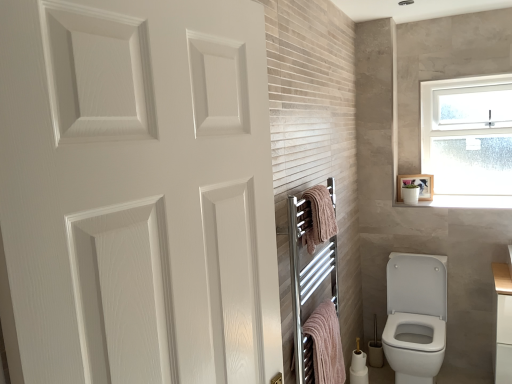
At what (x,y) coordinates should I click in order to perform the action: click on white glossy toilet paper at lower right, the 1th toilet paper from the top. Please return your answer as a coordinate pair (x, y). The height and width of the screenshot is (384, 512). Looking at the image, I should click on (358, 361).

This screenshot has height=384, width=512. What do you see at coordinates (416, 186) in the screenshot? I see `white glossy medicine cabinet at upper right` at bounding box center [416, 186].

Measure the distance between pink fabric towel at center, acting as the second bath towel starting from the bottom, and camera.

pink fabric towel at center, acting as the second bath towel starting from the bottom, and camera are 1.79 meters apart from each other.

What is the approximate width of pink fabric towel at center, acting as the second bath towel starting from the bottom?

It is 4.83 inches.

The width and height of the screenshot is (512, 384). What do you see at coordinates (463, 201) in the screenshot? I see `white ceramic window sill at upper right` at bounding box center [463, 201].

Where is `white glossy toilet paper at lower right, placed as the second toilet paper when sorted from top to bottom`? white glossy toilet paper at lower right, placed as the second toilet paper when sorted from top to bottom is located at coordinates (358, 366).

From a real-world perspective, is pink fabric towel at center-right, arranged as the 2th bath towel when viewed from the top, under white glossy medicine cabinet at upper right?

Yes, from a real-world perspective, pink fabric towel at center-right, arranged as the 2th bath towel when viewed from the top, is beneath white glossy medicine cabinet at upper right.

Is pink fabric towel at center-right, arranged as the 2th bath towel when viewed from the top, closer to camera compared to white glossy medicine cabinet at upper right?

Yes, it is.

Is pink fabric towel at center-right, which is counted as the first bath towel, starting from the bottom, situated inside white glossy medicine cabinet at upper right or outside?

pink fabric towel at center-right, which is counted as the first bath towel, starting from the bottom, is spatially situated outside white glossy medicine cabinet at upper right.

Is pink fabric towel at center-right, arranged as the 2th bath towel when viewed from the top, next to white glossy medicine cabinet at upper right?

No, pink fabric towel at center-right, arranged as the 2th bath towel when viewed from the top, is not next to white glossy medicine cabinet at upper right.

How different are the orientations of white glossy medicine cabinet at upper right and white glossy toilet at lower right in degrees?

The angle between the facing direction of white glossy medicine cabinet at upper right and the facing direction of white glossy toilet at lower right is 18.6 degrees.

Between white glossy medicine cabinet at upper right and white glossy toilet at lower right, which one has smaller size?

white glossy medicine cabinet at upper right.

Is white glossy toilet at lower right at the back of white glossy medicine cabinet at upper right?

No, white glossy toilet at lower right is not at the back of white glossy medicine cabinet at upper right.

Which point is more forward, [222,106] or [397,189]?

Positioned in front is point [222,106].

Considering the relative sizes of white matte door at upper left and white glossy medicine cabinet at upper right in the image provided, is white matte door at upper left bigger than white glossy medicine cabinet at upper right?

Correct, white matte door at upper left is larger in size than white glossy medicine cabinet at upper right.

From a real-world perspective, is white matte door at upper left over white glossy medicine cabinet at upper right?

Correct, in the physical world, white matte door at upper left is higher than white glossy medicine cabinet at upper right.

What are the coordinates of `door above the white glossy medicine cabinet at upper right (from a real-world perspective)` in the screenshot? It's located at (136, 186).

Is point (304, 195) closer to viewer compared to point (297, 298)?

No, (304, 195) is further to viewer.

Which of these two, pink fabric towel at center, the 1th bath towel when ordered from top to bottom, or chrome towel rack at center, stands shorter?

With less height is pink fabric towel at center, the 1th bath towel when ordered from top to bottom.

How far apart are pink fabric towel at center, the 1th bath towel when ordered from top to bottom, and chrome towel rack at center?

They are 7.18 inches apart.

Considering the sizes of objects pink fabric towel at center, acting as the second bath towel starting from the bottom, and chrome towel rack at center in the image provided, who is smaller, pink fabric towel at center, acting as the second bath towel starting from the bottom, or chrome towel rack at center?

pink fabric towel at center, acting as the second bath towel starting from the bottom, is smaller.

Considering the relative positions of white frosted glass window at upper right and white matte door at upper left in the image provided, is white frosted glass window at upper right to the left of white matte door at upper left from the viewer's perspective?

Incorrect, white frosted glass window at upper right is not on the left side of white matte door at upper left.

Considering the relative sizes of white frosted glass window at upper right and white matte door at upper left in the image provided, is white frosted glass window at upper right taller than white matte door at upper left?

No, white frosted glass window at upper right is not taller than white matte door at upper left.

In the scene shown: Do you think white frosted glass window at upper right is within white matte door at upper left, or outside of it?

white frosted glass window at upper right cannot be found inside white matte door at upper left.

From a real-world perspective, is white frosted glass window at upper right positioned under white matte door at upper left based on gravity?

No, from a real-world perspective, white frosted glass window at upper right is not under white matte door at upper left.

Looking at their sizes, would you say white glossy medicine cabinet at upper right is wider or thinner than white ceramic window sill at upper right?

Clearly, white glossy medicine cabinet at upper right has less width compared to white ceramic window sill at upper right.

Between white glossy medicine cabinet at upper right and white ceramic window sill at upper right, which one has more height?

With more height is white glossy medicine cabinet at upper right.

From a real-world perspective, is white glossy medicine cabinet at upper right on white ceramic window sill at upper right?

Correct, in the physical world, white glossy medicine cabinet at upper right is higher than white ceramic window sill at upper right.

From the image's perspective, which object appears higher, white glossy medicine cabinet at upper right or white ceramic window sill at upper right?

white glossy medicine cabinet at upper right.

Is white glossy toilet paper at lower right, which is the first toilet paper from bottom to top, looking in the opposite direction of white glossy toilet paper at lower right, positioned as the second toilet paper in bottom-to-top order?

Yes, white glossy toilet paper at lower right, which is the first toilet paper from bottom to top,'s orientation is away from white glossy toilet paper at lower right, positioned as the second toilet paper in bottom-to-top order.

Considering the positions of objects white glossy toilet paper at lower right, which is the first toilet paper from bottom to top, and white glossy toilet paper at lower right, the 1th toilet paper from the top, in the image provided, who is more to the right, white glossy toilet paper at lower right, which is the first toilet paper from bottom to top, or white glossy toilet paper at lower right, the 1th toilet paper from the top,?

white glossy toilet paper at lower right, which is the first toilet paper from bottom to top.

Considering the relative sizes of white glossy toilet paper at lower right, which is the first toilet paper from bottom to top, and white glossy toilet paper at lower right, positioned as the second toilet paper in bottom-to-top order, in the image provided, is white glossy toilet paper at lower right, which is the first toilet paper from bottom to top, smaller than white glossy toilet paper at lower right, positioned as the second toilet paper in bottom-to-top order,?

Incorrect, white glossy toilet paper at lower right, which is the first toilet paper from bottom to top, is not smaller in size than white glossy toilet paper at lower right, positioned as the second toilet paper in bottom-to-top order.

From a real-world perspective, is white glossy toilet paper at lower right, placed as the second toilet paper when sorted from top to bottom, positioned over white glossy toilet paper at lower right, positioned as the second toilet paper in bottom-to-top order, based on gravity?

No.

Locate an element on the screen. This screenshot has height=384, width=512. medicine cabinet on the right side of pink fabric towel at center-right, which is counted as the first bath towel, starting from the bottom is located at coordinates (416, 186).

Where is `toilet below the white glossy medicine cabinet at upper right (from a real-world perspective)`? toilet below the white glossy medicine cabinet at upper right (from a real-world perspective) is located at coordinates (415, 316).

Considering their positions, is white glossy toilet at lower right positioned closer to white glossy toilet paper at lower right, which is the first toilet paper from bottom to top, than white frosted glass window at upper right?

white glossy toilet at lower right is positioned closer to the anchor white glossy toilet paper at lower right, which is the first toilet paper from bottom to top.

Estimate the real-world distances between objects in this image. Which object is closer to pink fabric towel at center-right, arranged as the 2th bath towel when viewed from the top, chrome towel rack at center or white frosted glass window at upper right?

chrome towel rack at center is closer to pink fabric towel at center-right, arranged as the 2th bath towel when viewed from the top.

Estimate the real-world distances between objects in this image. Which object is further from white glossy medicine cabinet at upper right, white ceramic window sill at upper right or white glossy toilet paper at lower right, which is the first toilet paper from bottom to top?

Among the two, white glossy toilet paper at lower right, which is the first toilet paper from bottom to top, is located further to white glossy medicine cabinet at upper right.

Considering their positions, is pink fabric towel at center-right, which is counted as the first bath towel, starting from the bottom, positioned further to white glossy medicine cabinet at upper right than white glossy toilet at lower right?

Among the two, pink fabric towel at center-right, which is counted as the first bath towel, starting from the bottom, is located further to white glossy medicine cabinet at upper right.

When comparing their distances from white matte door at upper left, does white frosted glass window at upper right or white glossy toilet paper at lower right, which is the first toilet paper from bottom to top, seem further?

white frosted glass window at upper right is further to white matte door at upper left.

Based on their spatial positions, is pink fabric towel at center, acting as the second bath towel starting from the bottom, or pink fabric towel at center-right, arranged as the 2th bath towel when viewed from the top, closer to white glossy toilet paper at lower right, placed as the second toilet paper when sorted from top to bottom?

pink fabric towel at center-right, arranged as the 2th bath towel when viewed from the top, is positioned closer to the anchor white glossy toilet paper at lower right, placed as the second toilet paper when sorted from top to bottom.

When comparing their distances from chrome towel rack at center, does white matte door at upper left or white glossy medicine cabinet at upper right seem closer?

white matte door at upper left.

When comparing their distances from white glossy toilet paper at lower right, positioned as the second toilet paper in bottom-to-top order, does white glossy medicine cabinet at upper right or pink fabric towel at center-right, arranged as the 2th bath towel when viewed from the top, seem further?

The object further to white glossy toilet paper at lower right, positioned as the second toilet paper in bottom-to-top order, is white glossy medicine cabinet at upper right.

This screenshot has height=384, width=512. Find the location of `toilet between pink fabric towel at center-right, arranged as the 2th bath towel when viewed from the top, and white ceramic window sill at upper right from left to right`. toilet between pink fabric towel at center-right, arranged as the 2th bath towel when viewed from the top, and white ceramic window sill at upper right from left to right is located at coordinates (415, 316).

I want to click on toilet located between chrome towel rack at center and white glossy medicine cabinet at upper right in the depth direction, so click(415, 316).

This screenshot has height=384, width=512. In order to click on window between white matte door at upper left and white glossy medicine cabinet at upper right along the z-axis in this screenshot , I will do `click(468, 140)`.

Identify the location of bath towel between pink fabric towel at center, the 1th bath towel when ordered from top to bottom, and white glossy toilet paper at lower right, which is the first toilet paper from bottom to top, along the z-axis. (326, 344).